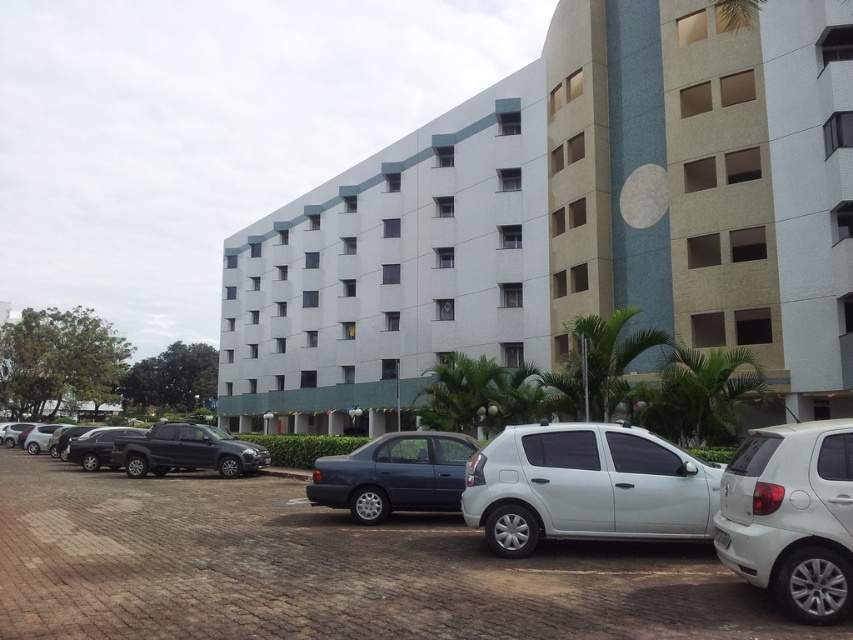
Question: Where is white smooth building at center located in relation to white matte hatchback at center in the image?

Choices:
 (A) left
 (B) right

Answer: (A)

Question: Among these points, which one is farthest from the camera?

Choices:
 (A) (779, 147)
 (B) (648, 509)
 (C) (253, 515)

Answer: (A)

Question: Considering the real-world distances, which object is farthest from the white smooth building at center?

Choices:
 (A) matte black sedan at left
 (B) shiny black sedan at left
 (C) white matte car at lower right
 (D) matte black pickup truck at lower left

Answer: (C)

Question: Which of the following is the closest to the observer?

Choices:
 (A) coord(468,548)
 (B) coord(378,448)

Answer: (A)

Question: Is white smooth building at center to the right of white matte car at lower right from the viewer's perspective?

Choices:
 (A) no
 (B) yes

Answer: (B)

Question: In this image, where is white matte car at lower right located relative to matte black sedan at left?

Choices:
 (A) below
 (B) above

Answer: (B)